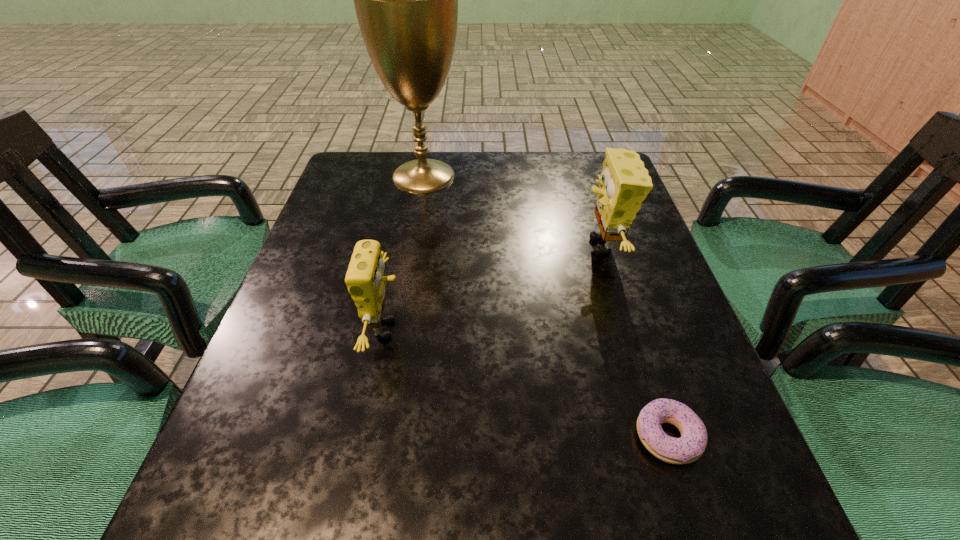
You are a GUI agent. You are given a task and a screenshot of the screen. Output one action in this format:
    pyautogui.click(x=<x>, y=<y>)
    Task: Click on the free region that satisfies the following two spatial constraints: 1. on the face of the doughnut; 2. on the right side of the left sponge
    The height and width of the screenshot is (540, 960).
    Given the screenshot: What is the action you would take?
    pyautogui.click(x=366, y=437)

Identify the location of vacant position in the image that satisfies the following two spatial constraints: 1. on the face of the right sponge; 2. on the back side of the nearest object. (660, 437).

At what (x,y) coordinates should I click in order to perform the action: click on vacant space that satisfies the following two spatial constraints: 1. on the face of the right sponge; 2. on the right side of the shortest object. Please return your answer as a coordinate pair (x, y). The image size is (960, 540). Looking at the image, I should click on (660, 437).

Where is `free location that satisfies the following two spatial constraints: 1. on the front side of the tallest object; 2. on the face of the third tallest object`? The image size is (960, 540). free location that satisfies the following two spatial constraints: 1. on the front side of the tallest object; 2. on the face of the third tallest object is located at coordinates (397, 329).

The width and height of the screenshot is (960, 540). I want to click on vacant area that satisfies the following two spatial constraints: 1. on the face of the shortest object; 2. on the left side of the left sponge, so click(x=366, y=437).